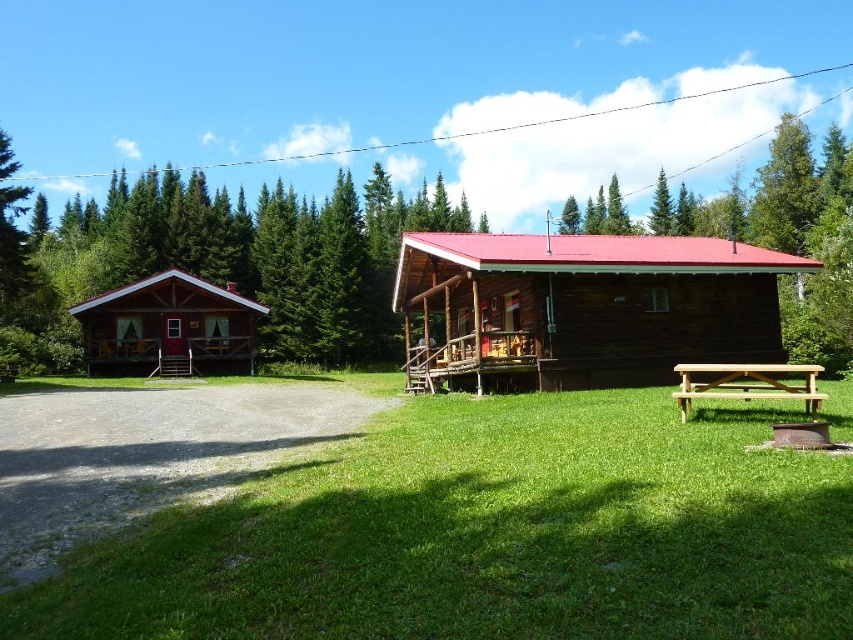
You are standing at the picnic table and want to take a photo of the green textured trees at upper center. Based on their coordinates, which direction should you face to capture them in your view?

The green textured trees at upper center are located at coordinates point (225, 260), which means they are positioned to the upper center of the image. To capture them, you should face upwards and towards the center of the scene.